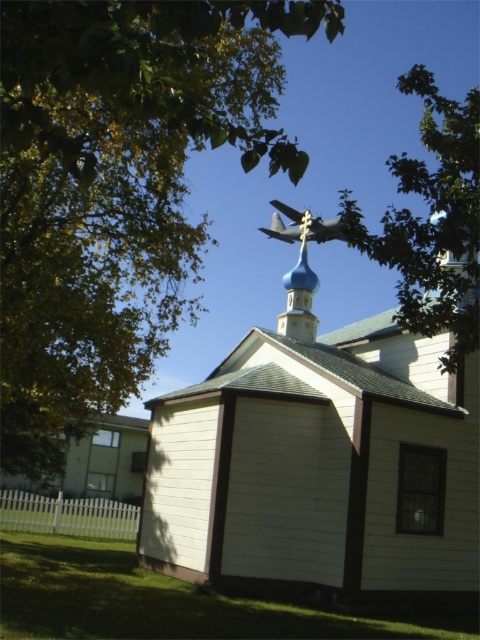
You are standing in front of the blue onion dome building and want to place a decoration at point (x=320, y=468). According to the image, where exactly on the white wood chapel at center should you place it?

The point (x=320, y=468) is located on the white wood chapel at center, so you should place the decoration there.

You are a photographer trying to capture the white wood chapel at center and the metallic gray airplane at upper center in a single shot. Based on their sizes in the image, which one would appear more prominent in the photo?

The white wood chapel at center appears more prominent in the photo because it is larger in size than the metallic gray airplane at upper center.

You are standing in front of the white wood chapel at center and want to take a photo of it without the green leafy tree at upper left blocking the view. Which direction should you move to ensure the tree is not in the frame?

Move to the right side of the white wood chapel at center so that the green leafy tree at upper left is no longer in the frame to the left.